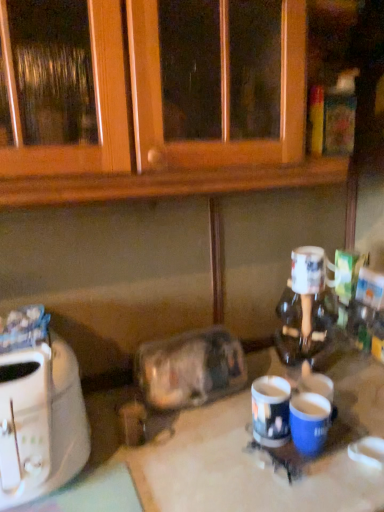
The width and height of the screenshot is (384, 512). What are the coordinates of `free area in between blue glossy mug at center, positioned as the second coffee cup in bottom-to-top order, and transparent plastic container at center` in the screenshot? It's located at (214, 423).